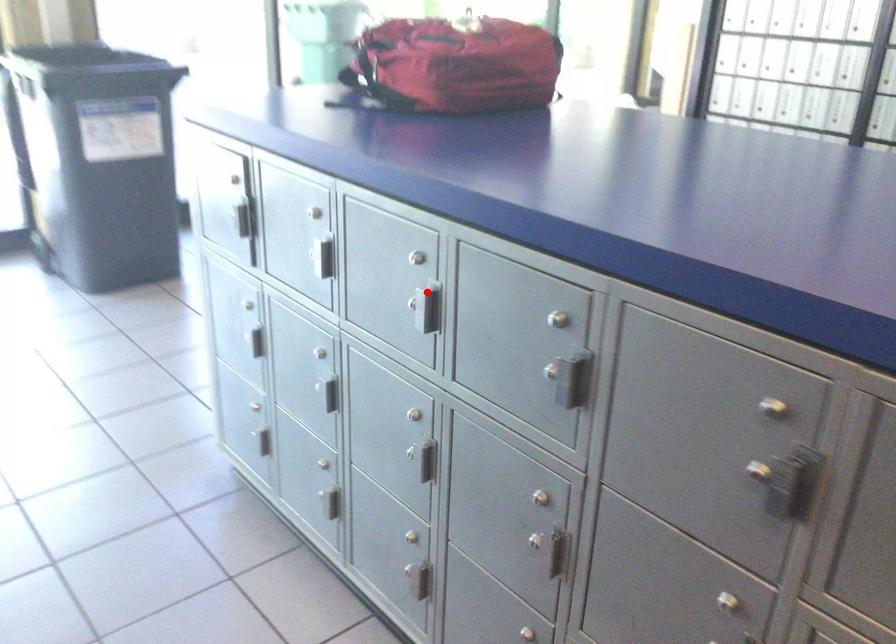
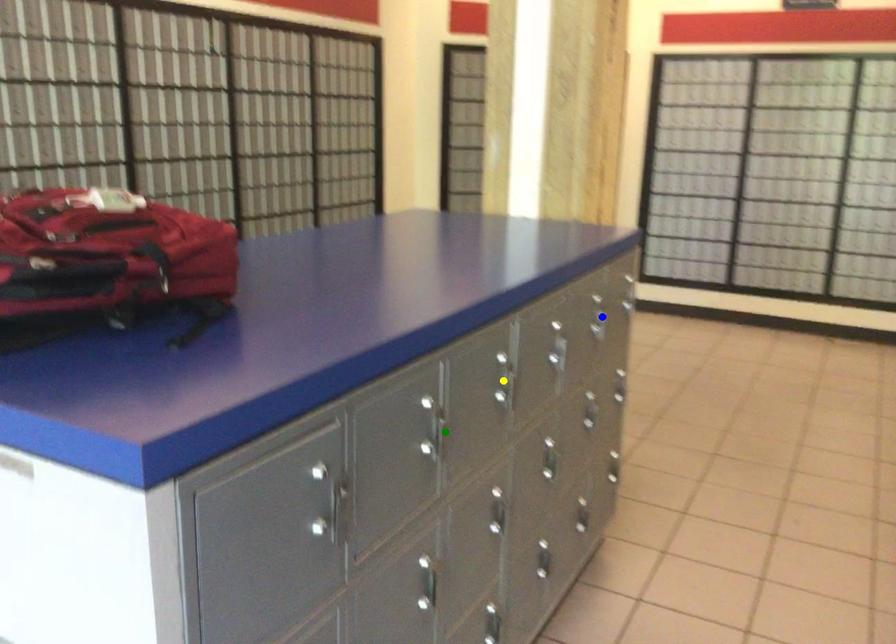
Question: I am providing you with two images of the same scene from different viewpoints. A red point is marked on the first image. You are given multiple points on the second image. Which point in image 2 represents the same 3d spot as the red point in image 1?

Choices:
 (A) blue point
 (B) yellow point
 (C) green point

Answer: (B)